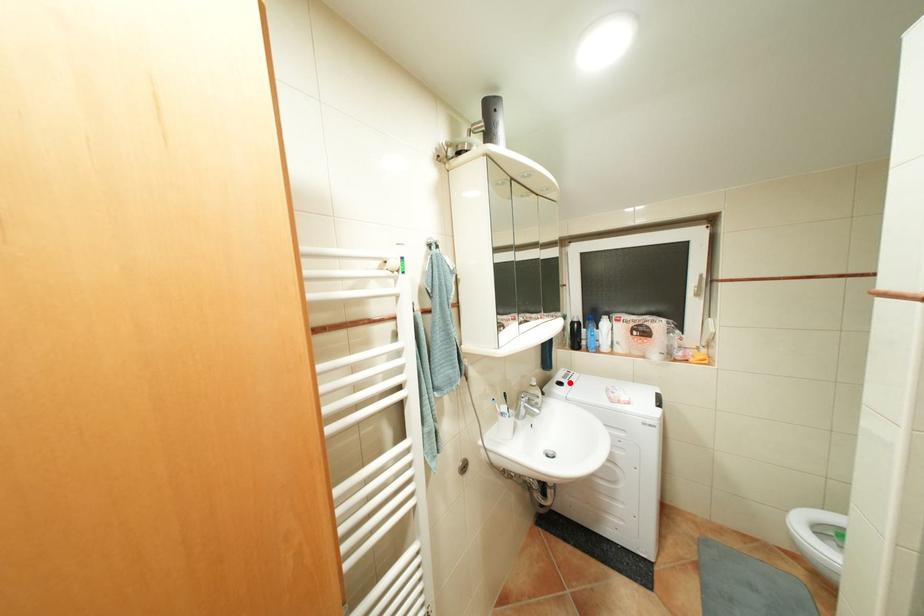
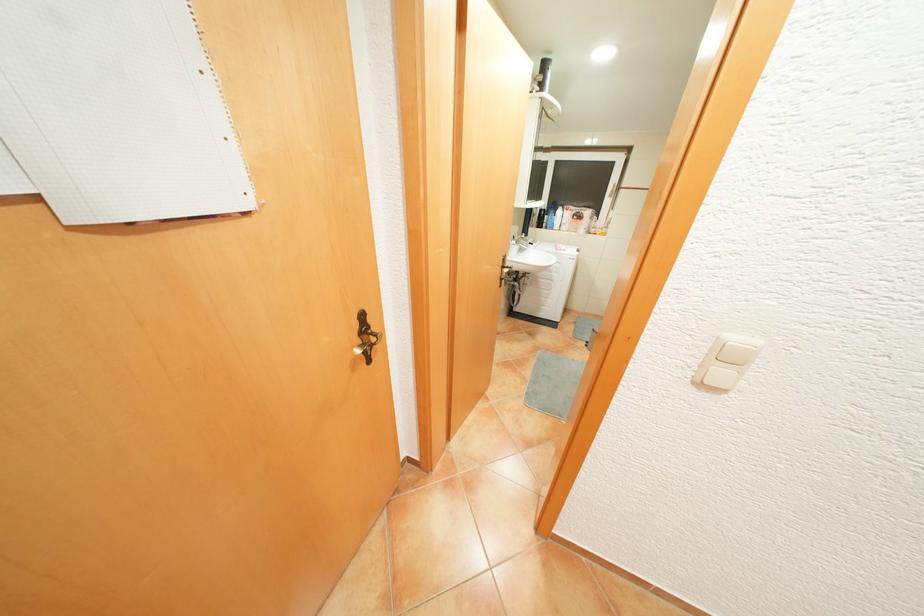
Question: I am providing you with two images of the same scene from different viewpoints. A red point is marked on the first image. At the location where the point appears in image 1, is it still visible in image 2?

Choices:
 (A) Yes
 (B) No

Answer: (B)